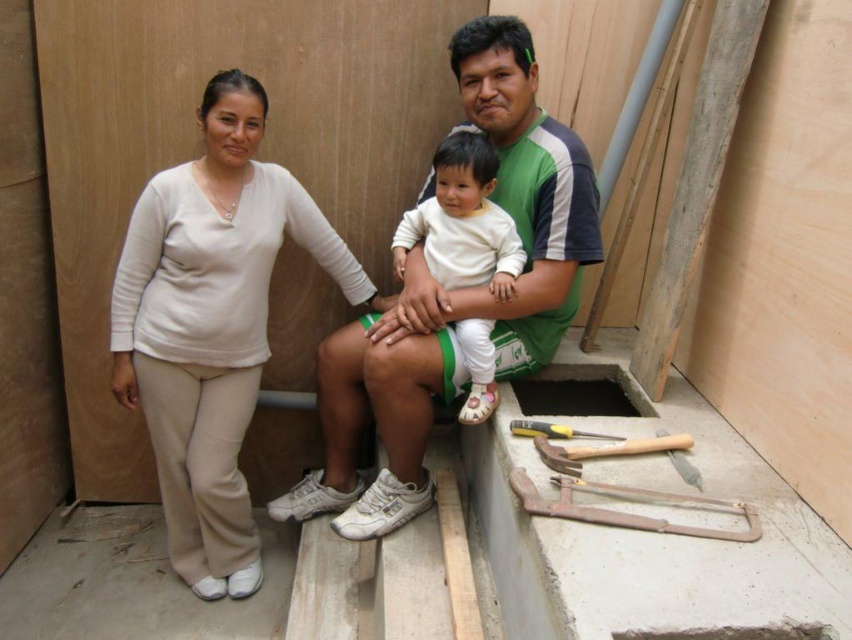
Question: Does beige fabric pants at left appear on the right side of green fabric shirt at center?

Choices:
 (A) no
 (B) yes

Answer: (A)

Question: Can you confirm if green fabric shirt at center is smaller than white soft fabric at center?

Choices:
 (A) no
 (B) yes

Answer: (A)

Question: Which point is closer to the camera?

Choices:
 (A) rusty metal saw at lower right
 (B) white soft fabric at center
 (C) yellow plastic screwdriver at lower center

Answer: (A)

Question: Is the position of green fabric shirt at center more distant than that of wooden hammer at lower center?

Choices:
 (A) no
 (B) yes

Answer: (B)

Question: Which point is closer to the camera?

Choices:
 (A) [620, 436]
 (B) [602, 456]
 (C) [551, 294]
 (D) [585, 516]

Answer: (D)

Question: Among these points, which one is nearest to the camera?

Choices:
 (A) (602, 452)
 (B) (181, 500)
 (C) (543, 428)

Answer: (A)